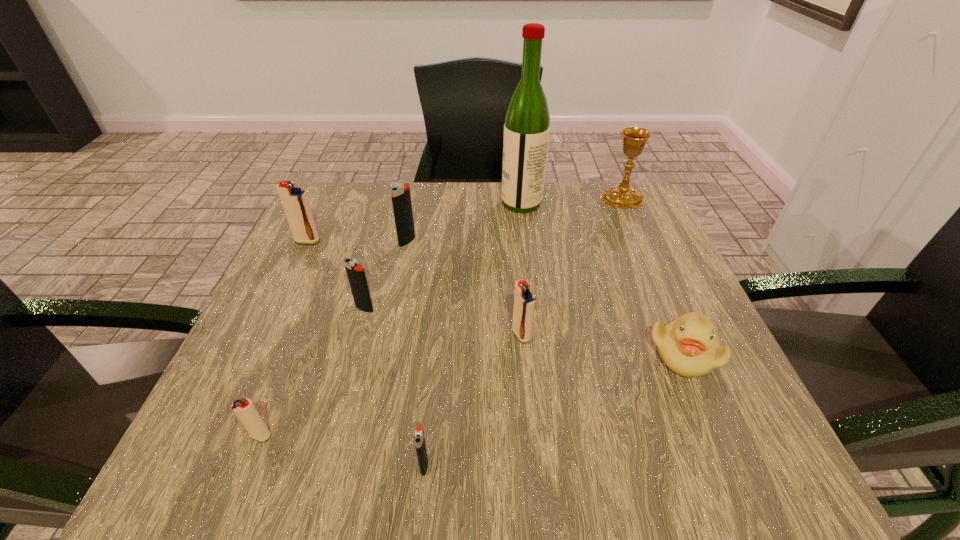
Where is `free region that satisfies the following two spatial constraints: 1. on the front side of the smallest black igniter; 2. on the right side of the second red igniter from right to left`? free region that satisfies the following two spatial constraints: 1. on the front side of the smallest black igniter; 2. on the right side of the second red igniter from right to left is located at coordinates point(249,465).

This screenshot has height=540, width=960. I want to click on blank area in the image that satisfies the following two spatial constraints: 1. on the back side of the second object from left to right; 2. on the left side of the sixth object from right to left, so click(337, 242).

This screenshot has width=960, height=540. Find the location of `blank area in the image that satisfies the following two spatial constraints: 1. on the back side of the farthest black igniter; 2. on the right side of the gold chalice`. blank area in the image that satisfies the following two spatial constraints: 1. on the back side of the farthest black igniter; 2. on the right side of the gold chalice is located at coordinates (417, 197).